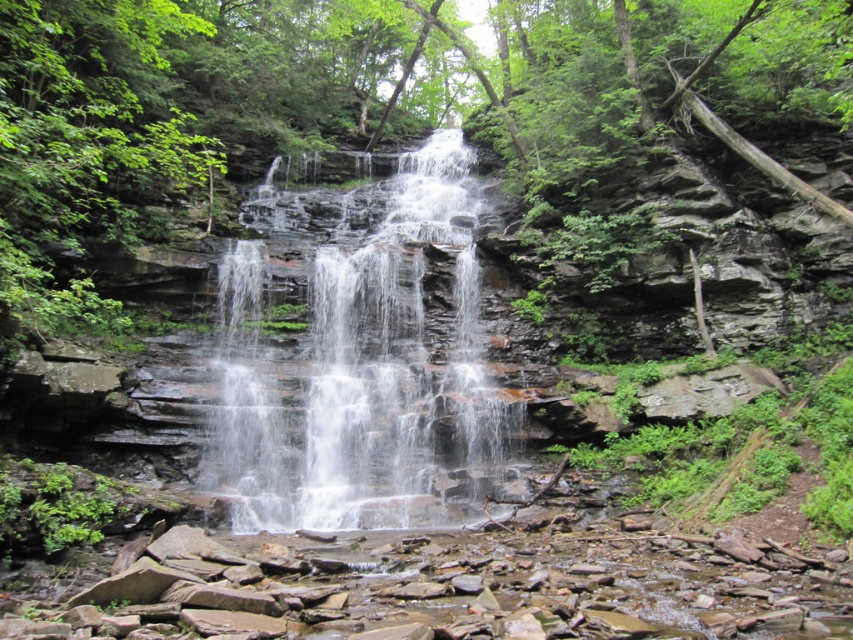
Question: Is green leafy forest at center to the left of clear water at center from the viewer's perspective?

Choices:
 (A) no
 (B) yes

Answer: (A)

Question: Which of the following is the farthest from the observer?

Choices:
 (A) clear water at center
 (B) green leafy forest at center

Answer: (A)

Question: Among these points, which one is farthest from the camera?

Choices:
 (A) (432, 426)
 (B) (289, 3)

Answer: (B)

Question: Is the position of green leafy forest at center less distant than that of clear water at center?

Choices:
 (A) no
 (B) yes

Answer: (B)

Question: Is green leafy forest at center positioned before clear water at center?

Choices:
 (A) no
 (B) yes

Answer: (B)